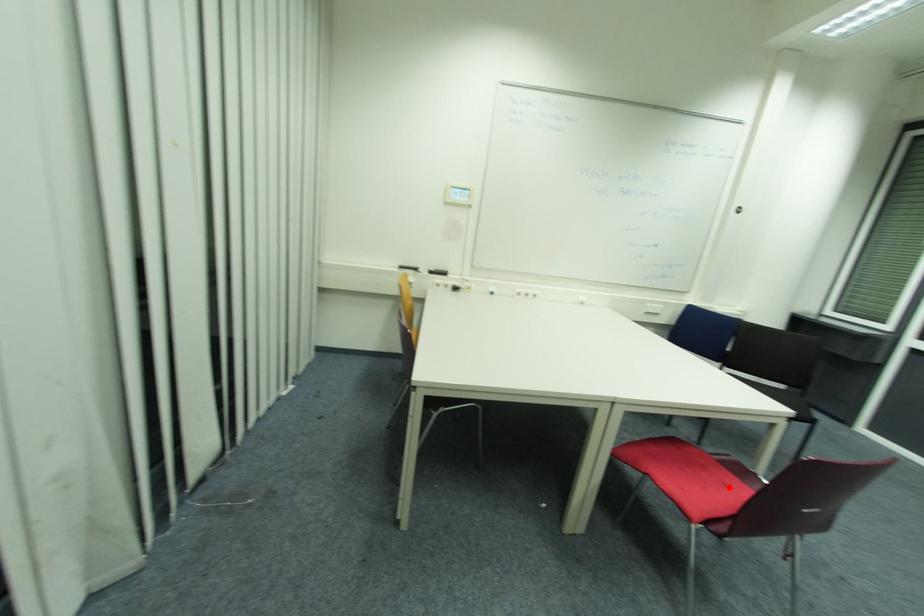
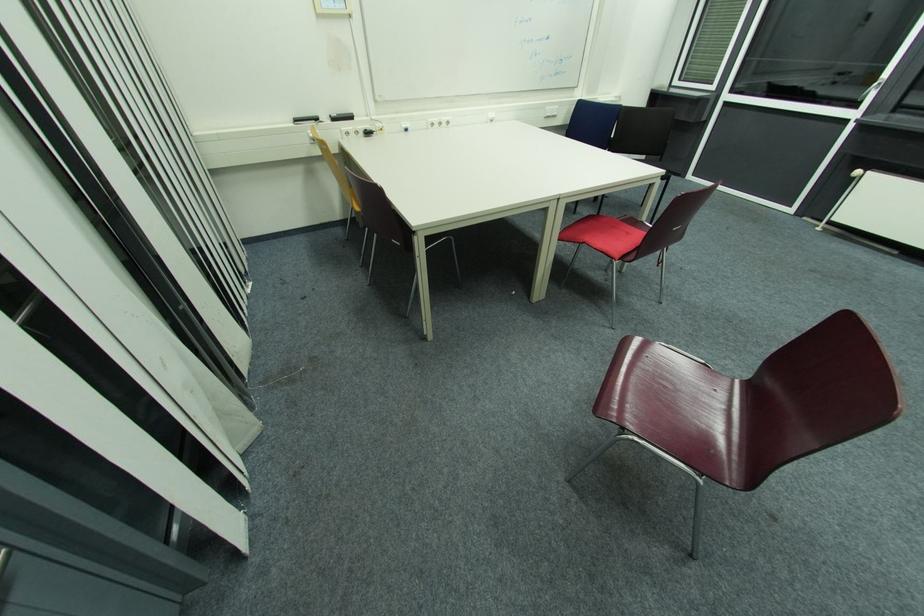
The point at the highlighted location is marked in the first image. Where is the corresponding point in the second image?

(631, 235)